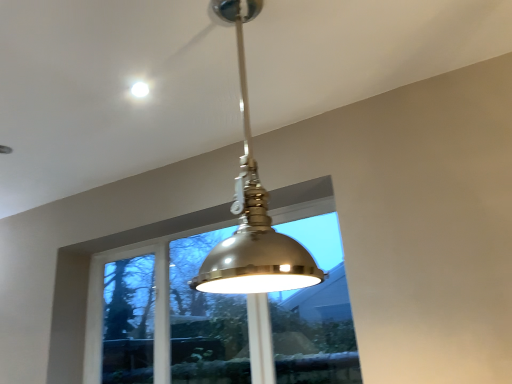
Question: Choose the correct answer: Is metallic dome at upper center inside clear glass window at center or outside it?

Choices:
 (A) outside
 (B) inside

Answer: (A)

Question: From a real-world perspective, relative to clear glass window at center, is metallic dome at upper center vertically above or below?

Choices:
 (A) above
 (B) below

Answer: (A)

Question: Which object is the farthest from the metallic dome at center?

Choices:
 (A) metallic dome at upper center
 (B) clear glass window at center

Answer: (B)

Question: Which object is the farthest from the metallic dome at center?

Choices:
 (A) clear glass window at center
 (B) metallic dome at upper center

Answer: (A)